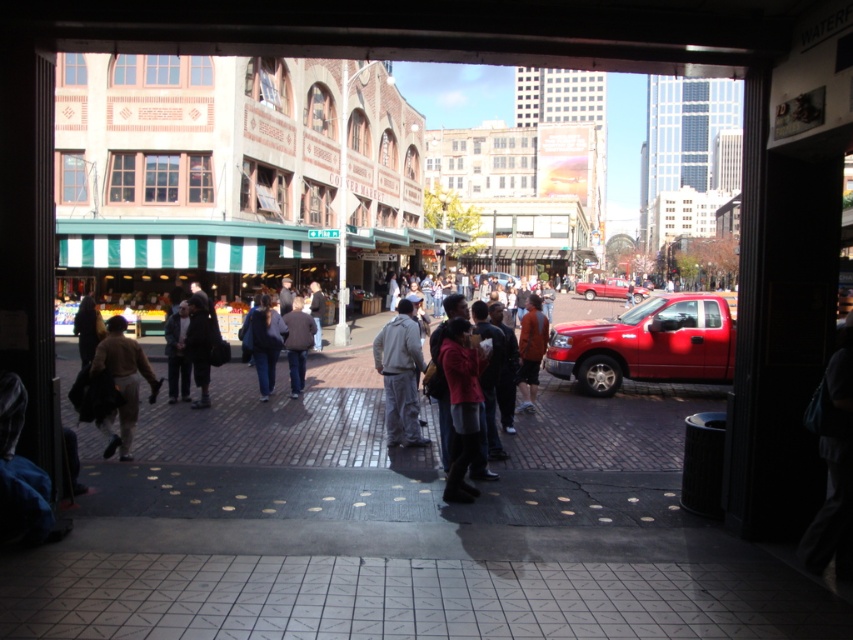
Question: Which object is positioned farthest from the metallic red truck at center?

Choices:
 (A) brick pavement at center
 (B) brown leather jacket at left

Answer: (B)

Question: From the image, what is the correct spatial relationship of brick pavement at center in relation to gray fabric jacket at center?

Choices:
 (A) left
 (B) right

Answer: (A)

Question: Which point is farther from the camera taking this photo?

Choices:
 (A) (456, 492)
 (B) (181, 358)
 (C) (293, 314)
 (D) (187, 493)

Answer: (C)

Question: In this image, where is brown leather jacket at left located relative to dark gray coat at center?

Choices:
 (A) above
 (B) below

Answer: (B)

Question: Which point is farther to the camera?

Choices:
 (A) (515, 515)
 (B) (192, 349)
 (C) (274, 353)

Answer: (C)

Question: Can you confirm if brick pavement at center is positioned above metallic red truck at center?

Choices:
 (A) yes
 (B) no

Answer: (B)